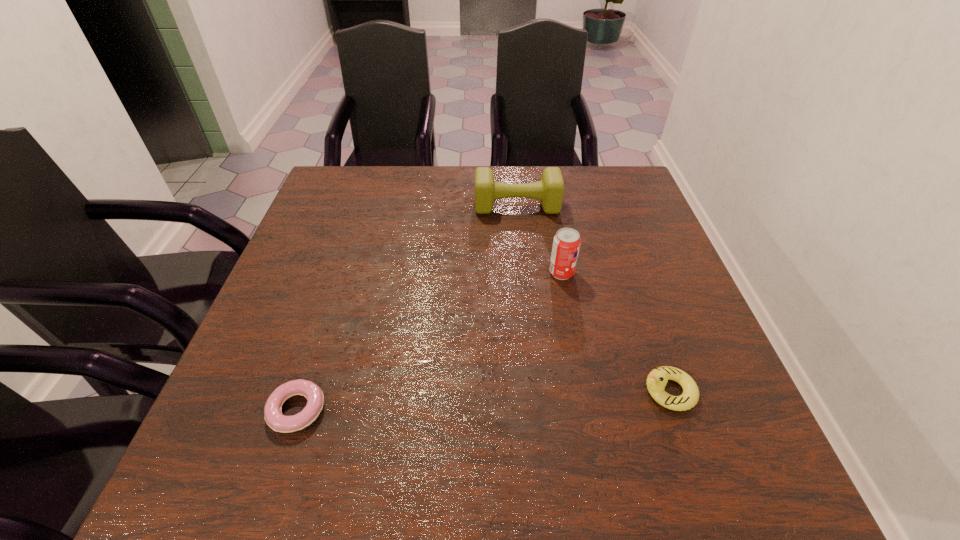
Where is `free location located on the face of the third tallest object`? The width and height of the screenshot is (960, 540). free location located on the face of the third tallest object is located at coordinates (431, 391).

This screenshot has width=960, height=540. What are the coordinates of `free space located 0.320m on the face of the third tallest object` in the screenshot? It's located at (468, 391).

The image size is (960, 540). In order to click on vacant region located on the right of the leftmost object in this screenshot , I will do `click(521, 410)`.

Where is `object located at the far edge`? object located at the far edge is located at coordinates (550, 189).

I want to click on object that is at the left edge, so click(x=273, y=416).

Find the location of `object at the right edge`. object at the right edge is located at coordinates (657, 379).

In the image, there is a desktop. At what (x,y) coordinates should I click in order to perform the action: click on vacant area at the far edge. Please return your answer as a coordinate pair (x, y). Looking at the image, I should click on (531, 198).

This screenshot has height=540, width=960. What are the coordinates of `vacant region at the near edge of the desktop` in the screenshot? It's located at (546, 468).

In the image, there is a desktop. Where is `free space at the left edge`? This screenshot has width=960, height=540. free space at the left edge is located at coordinates (277, 363).

The width and height of the screenshot is (960, 540). In the image, there is a desktop. In order to click on vacant space at the right edge in this screenshot , I will do `click(626, 295)`.